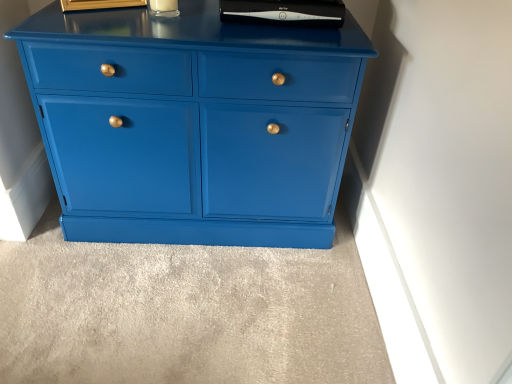
Locate an element on the screen. free spot in front of matte blue cabinet at center is located at coordinates (189, 304).